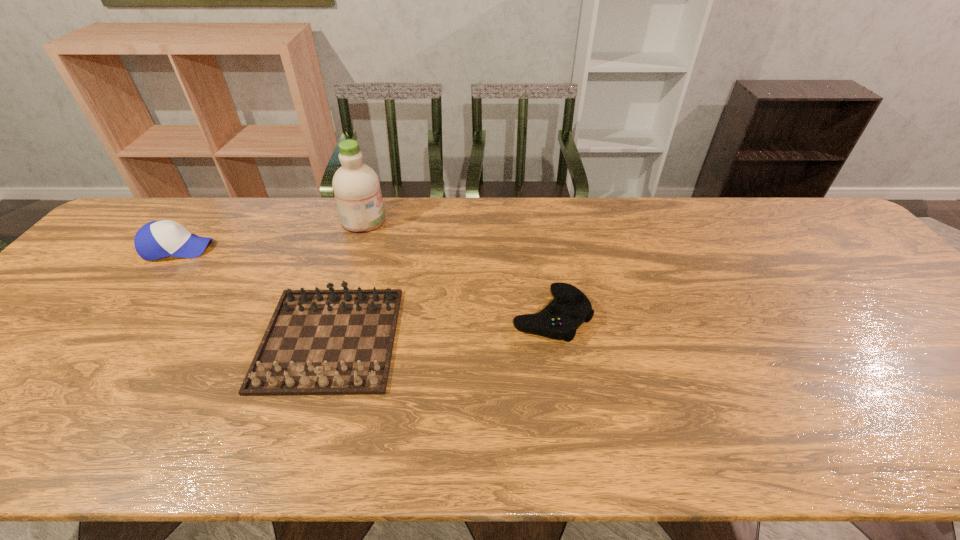
You are a GUI agent. You are given a task and a screenshot of the screen. Output one action in this format:
    pyautogui.click(x=<x>, y=<y>)
    Task: Click on the third closest object to the farthest object
    
    Given the screenshot: What is the action you would take?
    pyautogui.click(x=559, y=320)

This screenshot has width=960, height=540. Find the location of `free space that satisfies the following two spatial constraints: 1. on the front label of the chessboard; 2. on the left side of the cleansing agent`. free space that satisfies the following two spatial constraints: 1. on the front label of the chessboard; 2. on the left side of the cleansing agent is located at coordinates (324, 339).

This screenshot has height=540, width=960. Find the location of `vacant space that satisfies the following two spatial constraints: 1. on the front label of the chessboard; 2. on the right side of the farthest object`. vacant space that satisfies the following two spatial constraints: 1. on the front label of the chessboard; 2. on the right side of the farthest object is located at coordinates (324, 339).

Where is `free spot that satisfies the following two spatial constraints: 1. on the front label of the rightmost object; 2. on the left side of the farthest object`? This screenshot has width=960, height=540. free spot that satisfies the following two spatial constraints: 1. on the front label of the rightmost object; 2. on the left side of the farthest object is located at coordinates (332, 315).

In order to click on vacant position in the image that satisfies the following two spatial constraints: 1. on the front label of the farthest object; 2. on the left side of the chessboard in this screenshot , I will do `click(324, 339)`.

You are a GUI agent. You are given a task and a screenshot of the screen. Output one action in this format:
    pyautogui.click(x=<x>, y=<y>)
    Task: Click on the vacant position in the image that satisfies the following two spatial constraints: 1. on the front label of the rightmost object; 2. on the right side of the cleansing agent
    The image size is (960, 540).
    Given the screenshot: What is the action you would take?
    pyautogui.click(x=332, y=315)

The image size is (960, 540). In order to click on vacant space that satisfies the following two spatial constraints: 1. on the front label of the tallest object; 2. on the back side of the chessboard in this screenshot , I will do `click(324, 339)`.

Where is `free location that satisfies the following two spatial constraints: 1. on the back side of the chessboard; 2. on the front label of the farthest object`? The width and height of the screenshot is (960, 540). free location that satisfies the following two spatial constraints: 1. on the back side of the chessboard; 2. on the front label of the farthest object is located at coordinates (368, 220).

Identify the location of vacant area that satisfies the following two spatial constraints: 1. on the front label of the cleansing agent; 2. on the left side of the control. (332, 315).

This screenshot has width=960, height=540. I want to click on free space in the image that satisfies the following two spatial constraints: 1. on the front label of the chessboard; 2. on the right side of the tallest object, so click(x=324, y=339).